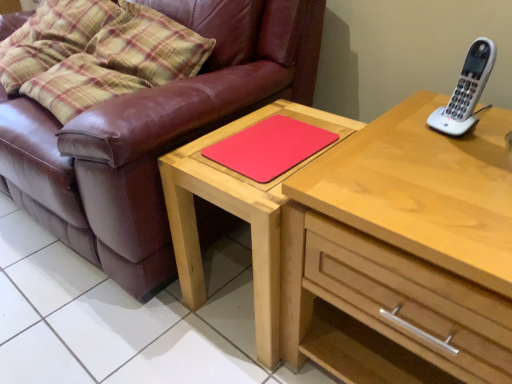
The width and height of the screenshot is (512, 384). I want to click on free spot above matte wooden table at center (from a real-world perspective), so click(x=273, y=137).